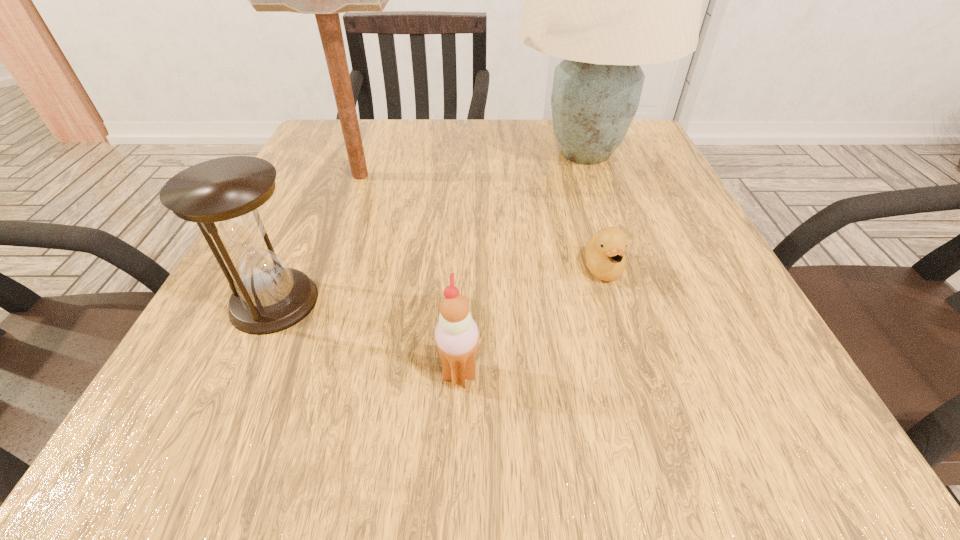
In the image, there is a desktop. At what (x,y) coordinates should I click in order to perform the action: click on vacant space at the near edge. Please return your answer as a coordinate pair (x, y). Looking at the image, I should click on (451, 435).

The image size is (960, 540). Identify the location of free space at the left edge. (298, 383).

You are a GUI agent. You are given a task and a screenshot of the screen. Output one action in this format:
    pyautogui.click(x=<x>, y=<y>)
    Task: Click on the vacant space at the right edge of the desktop
    Image resolution: width=960 pixels, height=540 pixels.
    Given the screenshot: What is the action you would take?
    pyautogui.click(x=739, y=295)

I want to click on vacant space at the far left corner of the desktop, so pyautogui.click(x=376, y=162).

Identify the location of free spot between the third tallest object and the icecream. (367, 338).

The image size is (960, 540). Identify the location of unoccupied area between the shortest object and the lampshade. (594, 211).

The width and height of the screenshot is (960, 540). In order to click on blank region between the mallet and the tallest object in this screenshot , I will do `click(472, 165)`.

Find the location of `free point between the second tallest object and the second shortest object`. free point between the second tallest object and the second shortest object is located at coordinates (410, 275).

You are a GUI agent. You are given a task and a screenshot of the screen. Output one action in this format:
    pyautogui.click(x=<x>, y=<y>)
    Task: Click on the vacant space that is in between the fourth tallest object and the second tallest object
    Image resolution: width=960 pixels, height=540 pixels.
    Given the screenshot: What is the action you would take?
    click(410, 275)

The image size is (960, 540). In order to click on free point between the hourglass and the tallest object in this screenshot , I will do `click(429, 227)`.